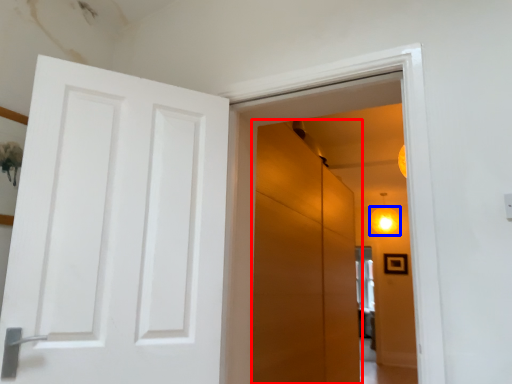
Question: Which object is closer to the camera taking this photo, screen door (highlighted by a red box) or lighting (highlighted by a blue box)?

Choices:
 (A) screen door
 (B) lighting

Answer: (A)